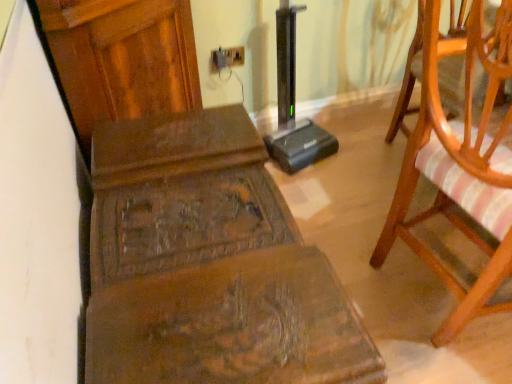
Identify the location of empty space that is ontop of wooden carved bench at center (from a real-world perspective). The image size is (512, 384). (183, 231).